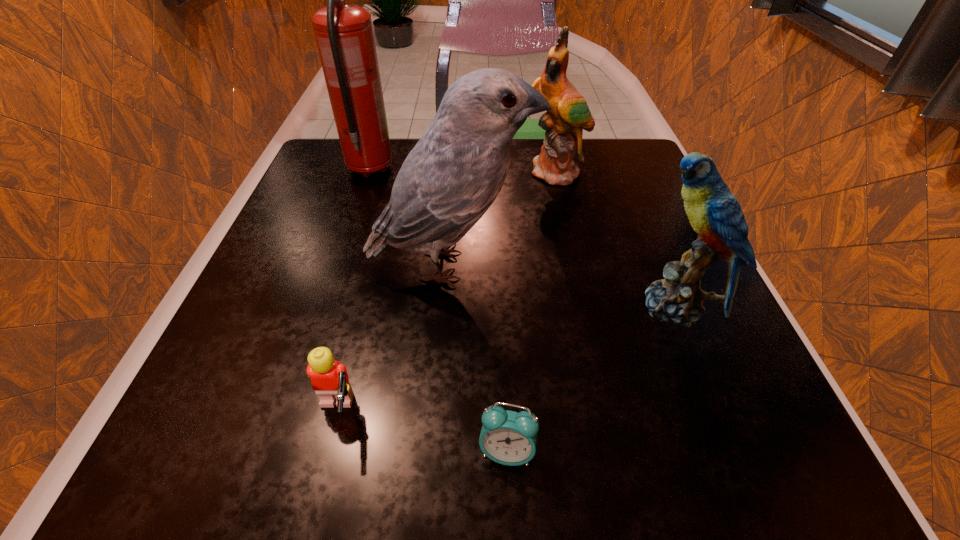
Locate an element on the screen. This screenshot has width=960, height=540. free space between the farthest parrot and the Lego is located at coordinates (446, 293).

In order to click on free space between the alarm clock and the third shortest object in this screenshot , I will do `click(590, 379)`.

The image size is (960, 540). Find the location of `vacant space that is in between the fire extinguisher and the shortest parrot`. vacant space that is in between the fire extinguisher and the shortest parrot is located at coordinates (522, 238).

Where is `free space between the shortest object and the Lego`? The image size is (960, 540). free space between the shortest object and the Lego is located at coordinates coord(421,433).

Identify the location of vacant space that's between the Lego and the fire extinguisher. (353, 291).

What are the coordinates of `free space between the farthest parrot and the rightmost parrot` in the screenshot? It's located at (615, 240).

I want to click on object that can be found as the second closest to the second parrot from right to left, so click(714, 213).

Find the location of `the third closest object to the rightmost parrot`. the third closest object to the rightmost parrot is located at coordinates (562, 148).

Locate which parrot is the closest to the rightmost object. Please provide its 2D coordinates. Your answer should be formatted as a tuple, i.e. [(x, y)], where the tuple contains the x and y coordinates of a point satisfying the conditions above.

[(451, 177)]

Point out which parrot is positioned as the third nearest to the Lego. Please provide its 2D coordinates. Your answer should be formatted as a tuple, i.e. [(x, y)], where the tuple contains the x and y coordinates of a point satisfying the conditions above.

[(562, 148)]